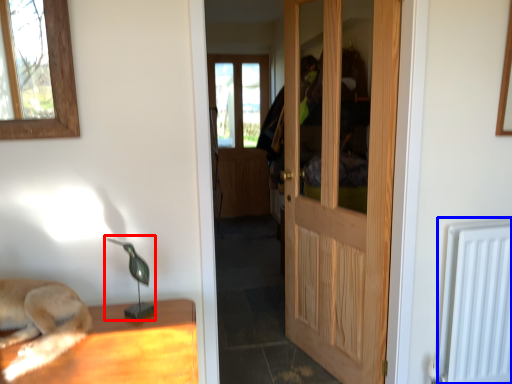
Question: Which of the following is the closest to the observer, table lamp (highlighted by a red box) or radiator (highlighted by a blue box)?

Choices:
 (A) table lamp
 (B) radiator

Answer: (A)